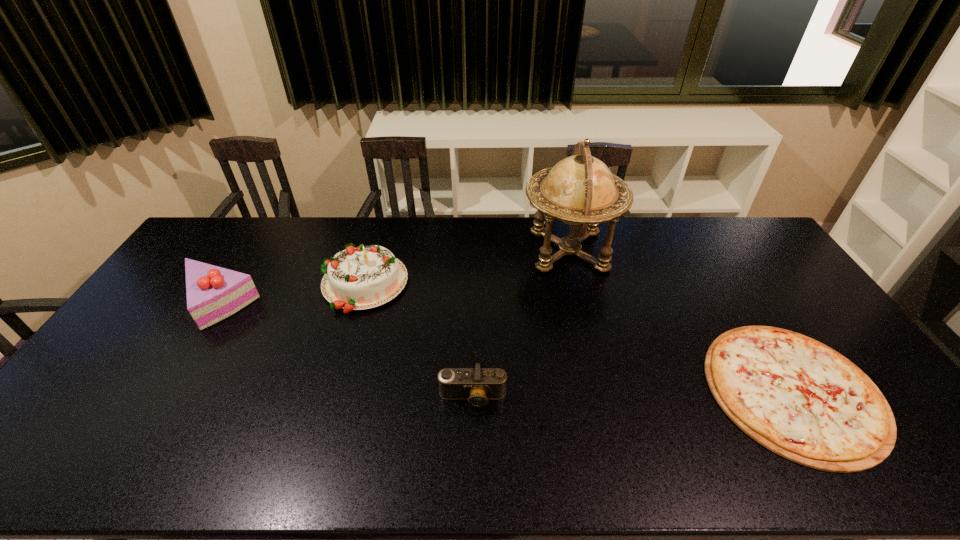
Identify the location of unoccupied position between the tallest object and the camera. This screenshot has width=960, height=540. (520, 324).

Find the location of a particular element. vacant space that is in between the rightmost object and the leftmost object is located at coordinates (506, 347).

The height and width of the screenshot is (540, 960). In order to click on free point between the second object from right to left and the pizza in this screenshot , I will do tap(681, 321).

The image size is (960, 540). Identify the location of free space between the tallest object and the rightmost object. (681, 321).

In order to click on free space between the second shortest object and the right cake in this screenshot , I will do `click(418, 340)`.

Where is `vacant space that's between the shortest object and the fourth object from right to left`? This screenshot has width=960, height=540. vacant space that's between the shortest object and the fourth object from right to left is located at coordinates (578, 337).

Locate which object ranks second in proximity to the leftmost object. Please provide its 2D coordinates. Your answer should be formatted as a tuple, i.e. [(x, y)], where the tuple contains the x and y coordinates of a point satisfying the conditions above.

[(477, 385)]

This screenshot has height=540, width=960. Identify the location of object that can be found as the fourth closest to the fourth tallest object. (213, 293).

Identify the location of free space that satisfies the following two spatial constraints: 1. on the back side of the pizza; 2. on the front-facing side of the globe. (708, 251).